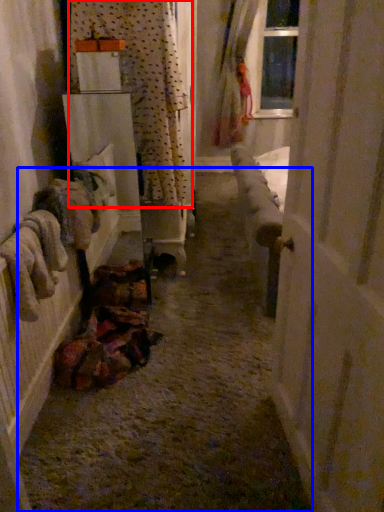
Question: Among these objects, which one is nearest to the camera, curtain (highlighted by a red box) or path (highlighted by a blue box)?

Choices:
 (A) curtain
 (B) path

Answer: (B)